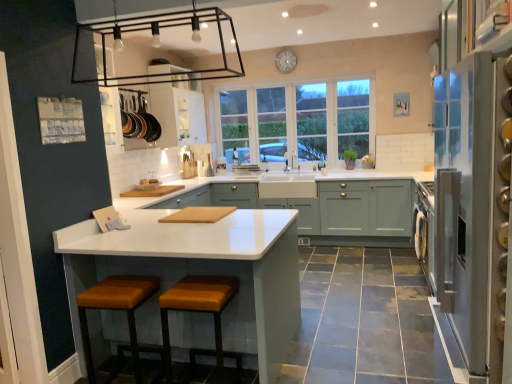
Question: Is orange fabric stool at lower center, the 1th step stool in the right-to-left sequence, not near white glass window at center?

Choices:
 (A) yes
 (B) no

Answer: (A)

Question: From the image's perspective, is orange fabric stool at lower center, the 1th step stool in the right-to-left sequence, above white glass window at center?

Choices:
 (A) yes
 (B) no

Answer: (B)

Question: From the image's perspective, is orange fabric stool at lower center, the 1th step stool in the right-to-left sequence, under white glass window at center?

Choices:
 (A) no
 (B) yes

Answer: (B)

Question: Would you say orange fabric stool at lower center, placed as the second step stool when sorted from left to right, contains white glass window at center?

Choices:
 (A) no
 (B) yes

Answer: (A)

Question: Is orange fabric stool at lower center, the 1th step stool in the right-to-left sequence, smaller than white glass window at center?

Choices:
 (A) no
 (B) yes

Answer: (B)

Question: In terms of size, does orange fabric stool at lower center, the 1th step stool in the right-to-left sequence, appear bigger or smaller than clear glass refrigerator at right?

Choices:
 (A) big
 (B) small

Answer: (B)

Question: From the image's perspective, relative to clear glass refrigerator at right, is orange fabric stool at lower center, placed as the second step stool when sorted from left to right, above or below?

Choices:
 (A) below
 (B) above

Answer: (A)

Question: In terms of height, does orange fabric stool at lower center, the 1th step stool in the right-to-left sequence, look taller or shorter compared to clear glass refrigerator at right?

Choices:
 (A) tall
 (B) short

Answer: (B)

Question: Is point 185,278 positioned closer to the camera than point 473,175?

Choices:
 (A) closer
 (B) farther

Answer: (B)

Question: In terms of size, does white matte clock at upper center appear bigger or smaller than white glossy cabinet at upper center, the 2th cabinetry from the bottom?

Choices:
 (A) big
 (B) small

Answer: (B)

Question: Relative to white glossy cabinet at upper center, marked as the first cabinetry in a left-to-right arrangement, is white matte clock at upper center in front or behind?

Choices:
 (A) front
 (B) behind

Answer: (B)

Question: Which is correct: white matte clock at upper center is inside white glossy cabinet at upper center, the 2th cabinetry from the bottom, or outside of it?

Choices:
 (A) outside
 (B) inside

Answer: (A)

Question: Looking at their shapes, would you say white matte clock at upper center is wider or thinner than white glossy cabinet at upper center, which is the second cabinetry in right-to-left order?

Choices:
 (A) wide
 (B) thin

Answer: (B)

Question: Considering their positions, is white glossy cabinet at upper center, the 2th cabinetry from the bottom, located in front of or behind clear glass refrigerator at right?

Choices:
 (A) front
 (B) behind

Answer: (B)

Question: Is white glossy cabinet at upper center, which is the second cabinetry in right-to-left order, to the left or to the right of clear glass refrigerator at right in the image?

Choices:
 (A) right
 (B) left

Answer: (B)